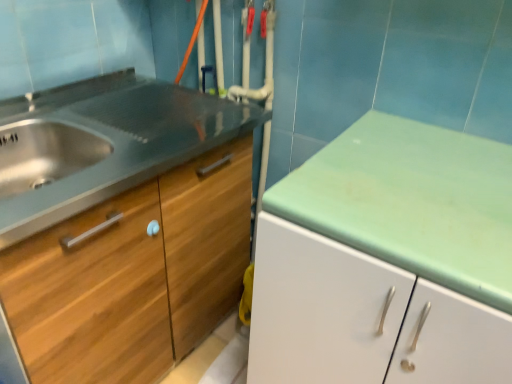
Question: Does wooden drawer at left come in front of wooden cabinet at left?

Choices:
 (A) yes
 (B) no

Answer: (A)

Question: Is wooden drawer at left looking in the opposite direction of wooden cabinet at left?

Choices:
 (A) no
 (B) yes

Answer: (B)

Question: Does wooden drawer at left have a larger size compared to wooden cabinet at left?

Choices:
 (A) yes
 (B) no

Answer: (B)

Question: Could you tell me if wooden drawer at left is facing wooden cabinet at left?

Choices:
 (A) yes
 (B) no

Answer: (A)

Question: Is wooden drawer at left thinner than wooden cabinet at left?

Choices:
 (A) yes
 (B) no

Answer: (A)

Question: Is wooden cabinet at left completely or partially inside wooden drawer at left?

Choices:
 (A) yes
 (B) no

Answer: (B)

Question: Is the position of wooden cabinet at left less distant than that of wooden drawer at left?

Choices:
 (A) yes
 (B) no

Answer: (B)

Question: Would you say wooden cabinet at left is a long distance from wooden drawer at left?

Choices:
 (A) yes
 (B) no

Answer: (B)

Question: Is wooden cabinet at left surrounding wooden drawer at left?

Choices:
 (A) no
 (B) yes

Answer: (B)

Question: Considering the relative sizes of wooden cabinet at left and wooden drawer at left in the image provided, is wooden cabinet at left smaller than wooden drawer at left?

Choices:
 (A) yes
 (B) no

Answer: (B)

Question: Can you confirm if wooden cabinet at left is positioned to the right of wooden drawer at left?

Choices:
 (A) no
 (B) yes

Answer: (B)

Question: Can you confirm if wooden cabinet at left is bigger than wooden drawer at left?

Choices:
 (A) no
 (B) yes

Answer: (B)

Question: Is wooden cabinet at left situated inside wooden drawer at left or outside?

Choices:
 (A) inside
 (B) outside

Answer: (B)